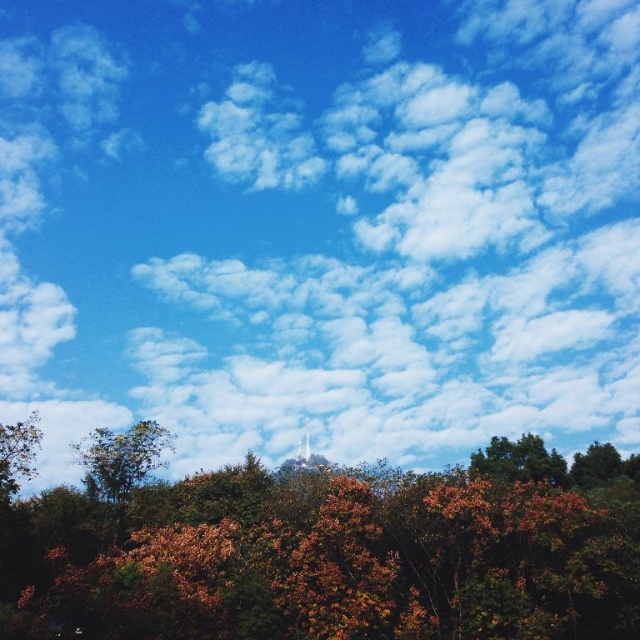
Question: Which object is the farthest from the brown matte tree at lower center?

Choices:
 (A) green matte tree at lower left
 (B) green matte tree at lower right
 (C) green leafy tree at left

Answer: (C)

Question: Which point is farther to the camera?

Choices:
 (A) (504, 461)
 (B) (355, 554)
 (C) (8, 496)

Answer: (A)

Question: Which point is farther to the camera?

Choices:
 (A) green matte tree at lower right
 (B) brown matte tree at lower center
 (C) green matte tree at lower left

Answer: (C)

Question: Does brown matte tree at lower center have a lesser width compared to green matte tree at lower left?

Choices:
 (A) yes
 (B) no

Answer: (B)

Question: Is brown matte tree at lower center wider than green matte tree at lower left?

Choices:
 (A) no
 (B) yes

Answer: (B)

Question: Is brown matte tree at lower center in front of green matte tree at lower left?

Choices:
 (A) no
 (B) yes

Answer: (B)